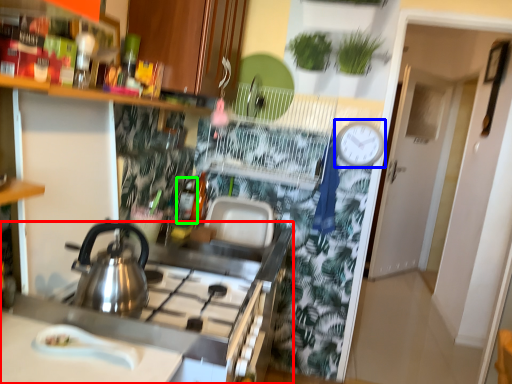
Question: Considering the real-world distances, which object is farthest from counter (highlighted by a red box)? clock (highlighted by a blue box) or bottle (highlighted by a green box)?

Choices:
 (A) clock
 (B) bottle

Answer: (A)